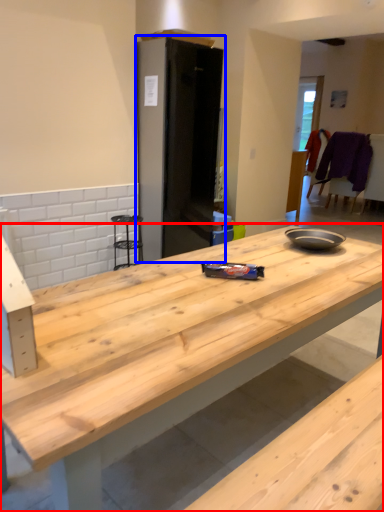
Question: Which of the following is the farthest to the observer, countertop (highlighted by a red box) or appliance (highlighted by a blue box)?

Choices:
 (A) countertop
 (B) appliance

Answer: (B)